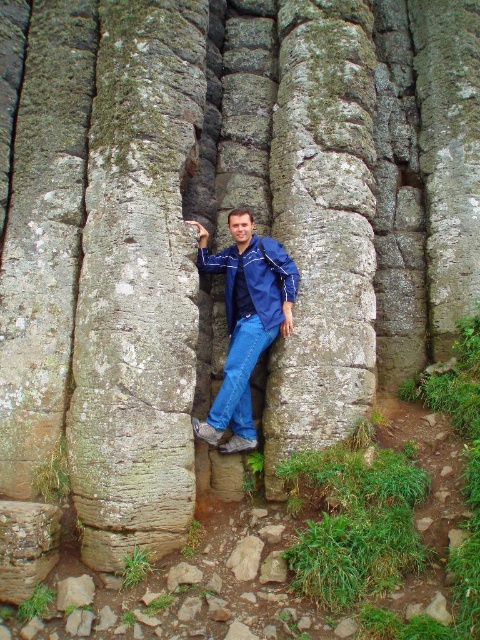
You are a photographer trying to capture the man in the image. You want to ensure both the blue denim jeans at center and the blue denim jacket at center are clearly visible in your shot. Based on their positions, which item should you focus on first to ensure depth of field?

The blue denim jeans at center is closer to the viewer than the blue denim jacket at center. To ensure both are in focus, you should focus on the blue denim jeans at center first, as it is the closer object, and adjust the depth of field to cover the jacket behind it.

You are a photographer planning to take a picture of the man standing between the two large rock formations. You want to ensure both the blue denim jeans at center and the blue denim jacket at center are clearly visible in the frame. Which of these clothing items will appear larger in the photo?

The blue denim jeans at center will appear larger in the photo because it is larger in size than the blue denim jacket at center according to the description.